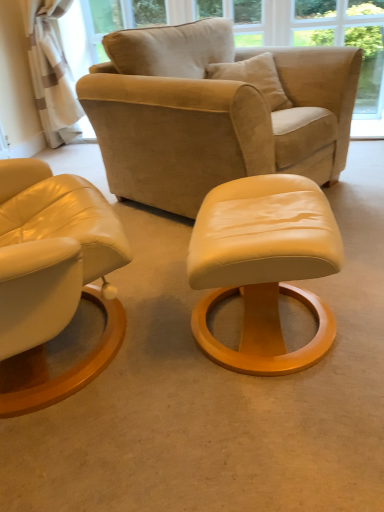
Question: Is point (319, 174) positioned closer to the camera than point (231, 258)?

Choices:
 (A) closer
 (B) farther

Answer: (B)

Question: From their relative heights in the image, would you say suede beige armchair at upper center is taller or shorter than matte cream leather ottoman at center?

Choices:
 (A) tall
 (B) short

Answer: (A)

Question: Considering the relative positions of suede beige armchair at upper center and matte cream leather ottoman at center in the image provided, is suede beige armchair at upper center to the left or to the right of matte cream leather ottoman at center?

Choices:
 (A) right
 (B) left

Answer: (B)

Question: Considering their positions, is matte cream leather ottoman at center located in front of or behind suede beige armchair at upper center?

Choices:
 (A) front
 (B) behind

Answer: (A)

Question: From a real-world perspective, is matte cream leather ottoman at center above or below suede beige armchair at upper center?

Choices:
 (A) below
 (B) above

Answer: (A)

Question: In the image, is matte cream leather ottoman at center on the left side or the right side of suede beige armchair at upper center?

Choices:
 (A) left
 (B) right

Answer: (B)

Question: From the image's perspective, is matte cream leather ottoman at center above or below suede beige armchair at upper center?

Choices:
 (A) below
 (B) above

Answer: (A)